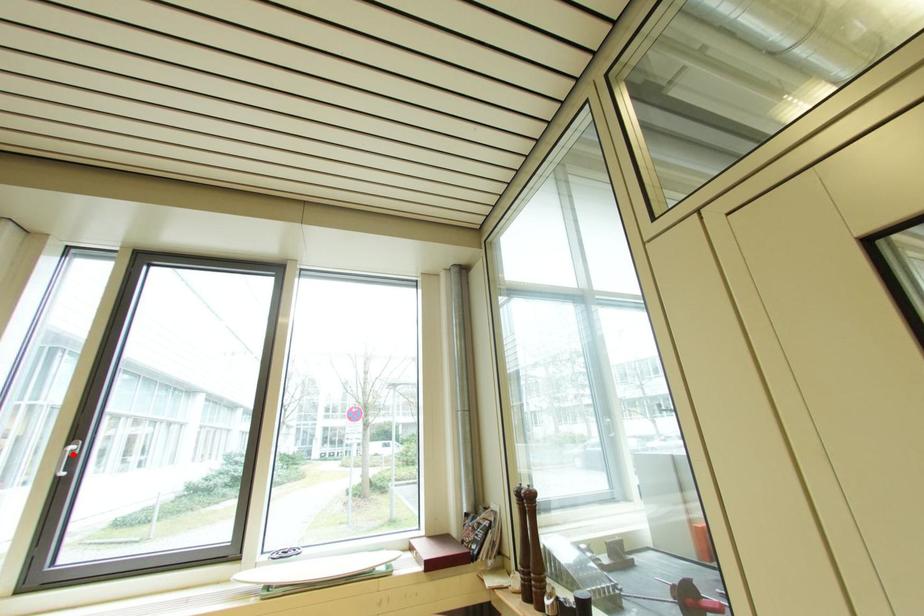
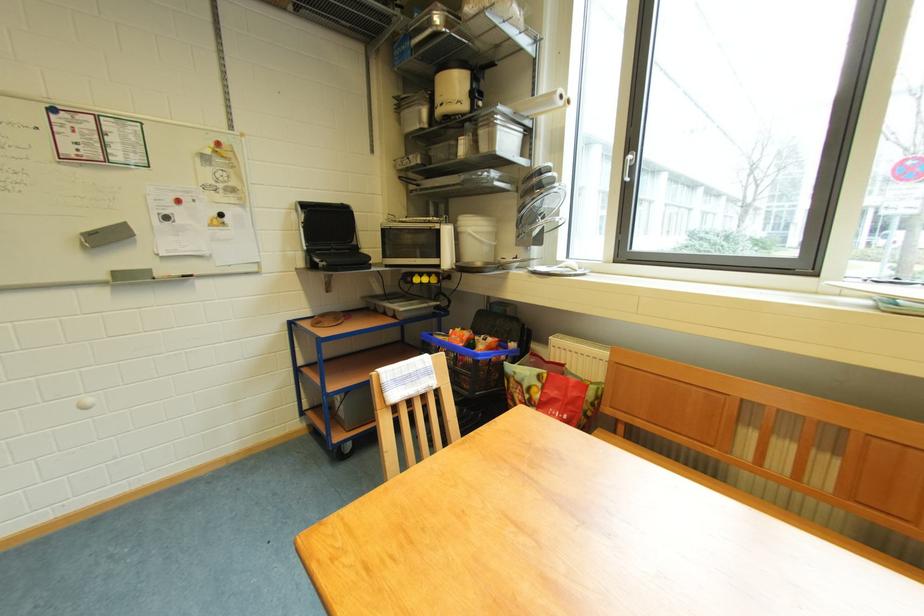
Question: I am providing you with two images of the same scene from different viewpoints. A red point is marked on the first image. At the location where the point appears in image 1, is it still visible in image 2?

Choices:
 (A) Yes
 (B) No

Answer: (A)